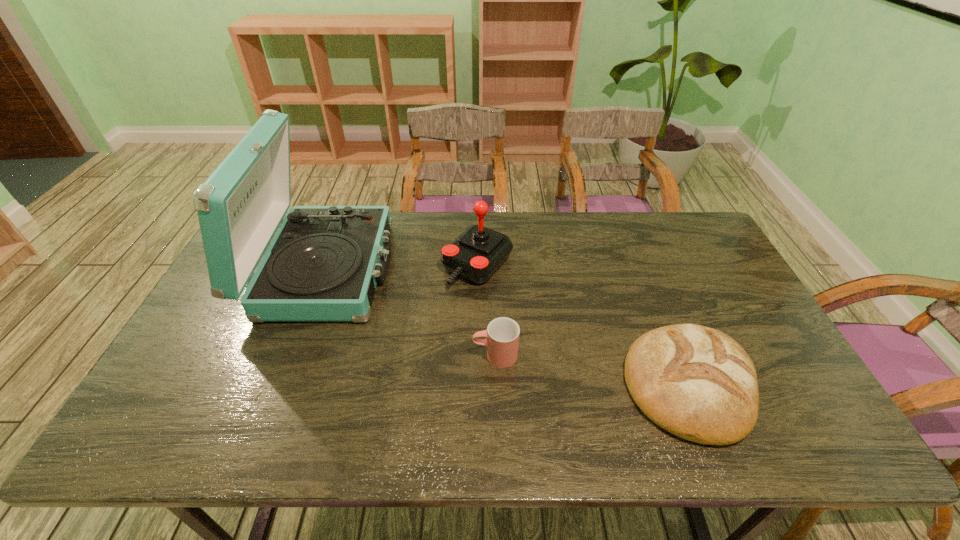
I want to click on the leftmost object, so click(x=323, y=265).

In order to click on record player in this screenshot , I will do `click(323, 265)`.

Where is `the third shortest object`? Image resolution: width=960 pixels, height=540 pixels. the third shortest object is located at coordinates (475, 255).

This screenshot has width=960, height=540. I want to click on cup, so click(x=502, y=335).

Where is `the rightmost object`? Image resolution: width=960 pixels, height=540 pixels. the rightmost object is located at coordinates (696, 382).

The image size is (960, 540). What are the coordinates of `free region located on the face side of the leftmost object` in the screenshot? It's located at (467, 269).

Find the location of `free region located on the right of the joystick`. free region located on the right of the joystick is located at coordinates (540, 265).

At what (x,y) coordinates should I click in order to perform the action: click on vacant region located 0.090m on the side of the cup with the handle. Please return your answer as a coordinate pair (x, y). The image size is (960, 540). Looking at the image, I should click on (439, 355).

What are the coordinates of `vacant region located 0.070m on the side of the cup with the handle` in the screenshot? It's located at (446, 355).

Find the location of `blank space located 0.100m on the side of the cup with the handle`. blank space located 0.100m on the side of the cup with the handle is located at coordinates (435, 355).